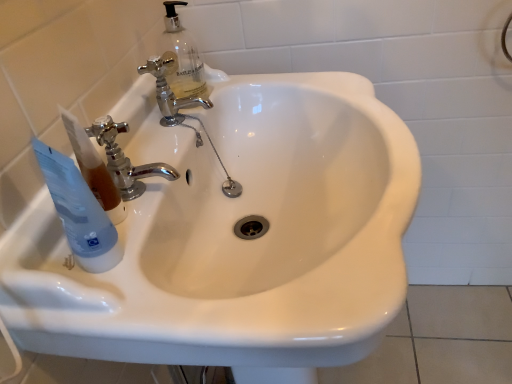
Question: Which is correct: transparent plastic tube at left is inside chrome metallic faucet at center, the 2th tap from the front, or outside of it?

Choices:
 (A) outside
 (B) inside

Answer: (A)

Question: In terms of width, does transparent plastic tube at left look wider or thinner when compared to chrome metallic faucet at center, the first tap from the top?

Choices:
 (A) wide
 (B) thin

Answer: (A)

Question: Which is farther from the transparent plastic tube at left?

Choices:
 (A) chrome metallic faucet at center, the second tap in the bottom-to-top sequence
 (B) chrome metallic faucet at upper left, arranged as the 1th tap when viewed from the front
 (C) white glossy sink at center

Answer: (A)

Question: Which object is the farthest from the chrome metallic faucet at center, the 2th tap from the front?

Choices:
 (A) white glossy sink at center
 (B) transparent plastic tube at left
 (C) chrome metallic faucet at upper left, the second tap positioned from the top

Answer: (B)